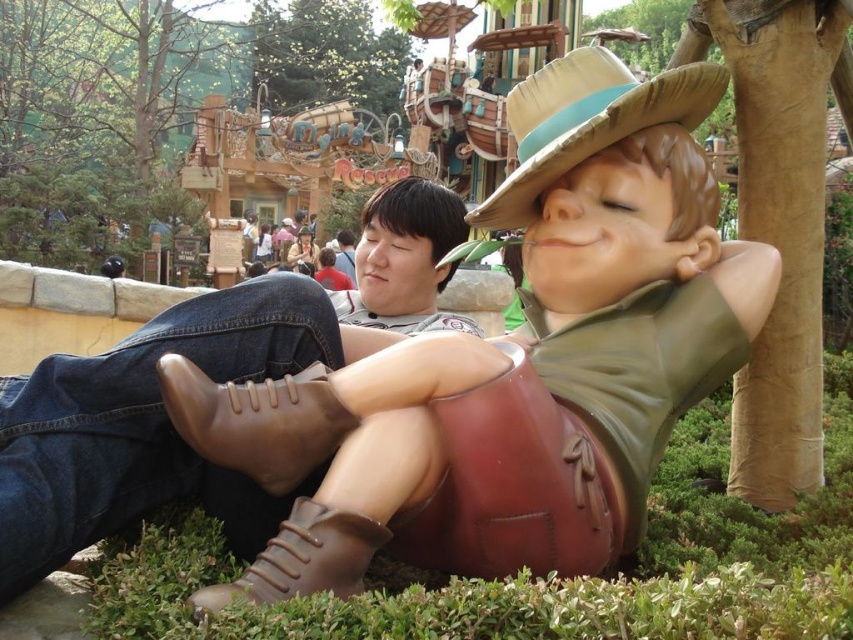
You are a photographer trying to capture a photo of the brown leather boots at lower center and the jeans at center. Which object should you focus on first if you want to ensure both are in focus?

The brown leather boots at lower center is closer to the viewer than jeans at center. To ensure both are in focus, focus on the brown leather boots at lower center first since it is closer, and the jeans at center will be in focus as it is further away but within the depth of field.

From the picture: You are a photographer at the theme park and want to capture a photo where both the brown leather boots at lower center and the brown straw hat at center are clearly visible. Based on their sizes, which object should you focus on first to ensure it isn

The brown leather boots at lower center is shorter than the brown straw hat at center, so you should focus on the brown leather boots at lower center first to ensure it is in focus before the taller object.